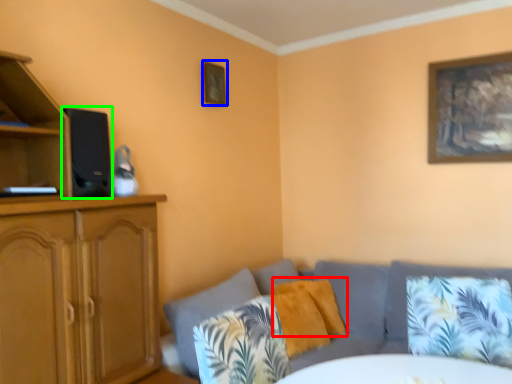
Question: Which object is the closest to the pillow (highlighted by a red box)? Choose among these: picture frame (highlighted by a blue box) or speaker (highlighted by a green box).

Choices:
 (A) picture frame
 (B) speaker

Answer: (A)